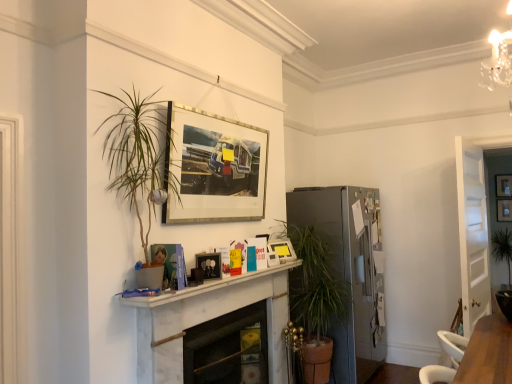
Question: Which direction should I rotate to look at silver metallic picture frame at upper center, the 2th picture frame in the left-to-right sequence, — up or down?

Choices:
 (A) down
 (B) up

Answer: (B)

Question: Which direction should I rotate to face matte plastic picture frame at center, placed as the 3th picture frame when sorted from back to front, — up or down?

Choices:
 (A) up
 (B) down

Answer: (B)

Question: Considering the relative sizes of silver metallic picture frame at upper center, the 2th picture frame in the left-to-right sequence, and matte silver picture frame at upper center, placed as the 4th picture frame when sorted from left to right, in the image provided, is silver metallic picture frame at upper center, the 2th picture frame in the left-to-right sequence, smaller than matte silver picture frame at upper center, placed as the 4th picture frame when sorted from left to right,?

Choices:
 (A) no
 (B) yes

Answer: (A)

Question: Can you confirm if silver metallic picture frame at upper center, the first picture frame from the front, is shorter than matte silver picture frame at upper center, the 1th picture frame positioned from the back?

Choices:
 (A) yes
 (B) no

Answer: (B)

Question: Is matte silver picture frame at upper center, the 1th picture frame positioned from the back, located within silver metallic picture frame at upper center, the first picture frame from the front?

Choices:
 (A) no
 (B) yes

Answer: (A)

Question: Is silver metallic picture frame at upper center, the fifth picture frame in the back-to-front sequence, at the left side of matte silver picture frame at upper center, the second picture frame positioned from the right?

Choices:
 (A) no
 (B) yes

Answer: (B)

Question: Does silver metallic picture frame at upper center, the 2th picture frame in the left-to-right sequence, have a lesser width compared to matte silver picture frame at upper center, the 5th picture frame in the front-to-back sequence?

Choices:
 (A) yes
 (B) no

Answer: (B)

Question: Does silver metallic picture frame at upper center, the first picture frame from the front, have a greater width compared to matte silver picture frame at upper center, the 5th picture frame in the front-to-back sequence?

Choices:
 (A) yes
 (B) no

Answer: (A)

Question: Is white marble mantle at center closer to camera compared to silver metallic picture frame at upper center, the 2th picture frame in the left-to-right sequence?

Choices:
 (A) yes
 (B) no

Answer: (A)

Question: From the image's perspective, is white marble mantle at center on silver metallic picture frame at upper center, the first picture frame from the front?

Choices:
 (A) no
 (B) yes

Answer: (A)

Question: Is white marble mantle at center facing away from silver metallic picture frame at upper center, which appears as the fourth picture frame when viewed from the right?

Choices:
 (A) no
 (B) yes

Answer: (A)

Question: Is white marble mantle at center taller than silver metallic picture frame at upper center, the first picture frame from the front?

Choices:
 (A) yes
 (B) no

Answer: (B)

Question: Considering the relative sizes of white marble mantle at center and silver metallic picture frame at upper center, the fifth picture frame in the back-to-front sequence, in the image provided, is white marble mantle at center bigger than silver metallic picture frame at upper center, the fifth picture frame in the back-to-front sequence,?

Choices:
 (A) no
 (B) yes

Answer: (A)

Question: Does white marble mantle at center have a lesser height compared to silver metallic picture frame at upper center, the fifth picture frame in the back-to-front sequence?

Choices:
 (A) yes
 (B) no

Answer: (A)

Question: Is white marble mantle at center outside of wooden picture frame at upper center, which is the 5th picture frame in left-to-right order?

Choices:
 (A) yes
 (B) no

Answer: (A)